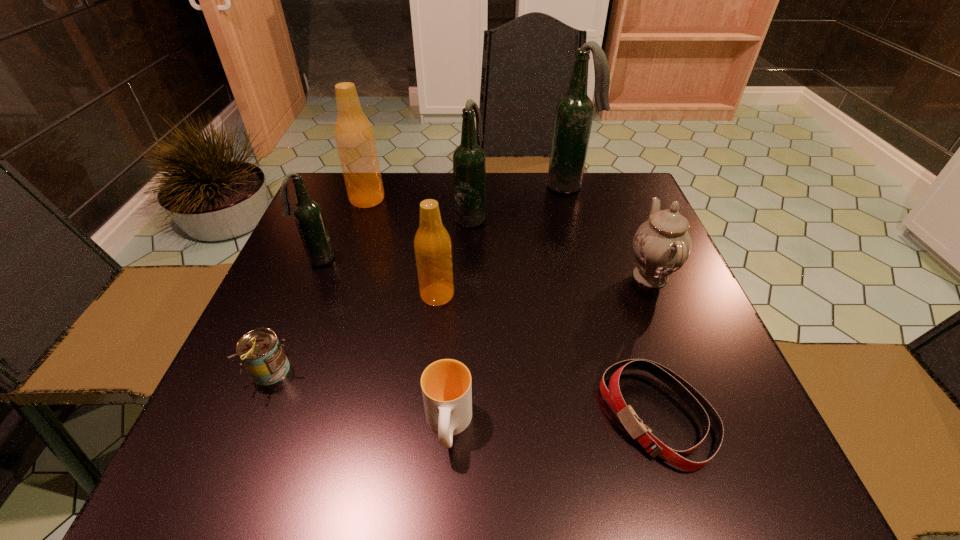
Locate an element on the screen. the farthest dark beer bottle is located at coordinates (574, 112).

You are a GUI agent. You are given a task and a screenshot of the screen. Output one action in this format:
    pyautogui.click(x=<x>, y=<y>)
    Task: Click on the biggest dark beer bottle
    
    Given the screenshot: What is the action you would take?
    pyautogui.click(x=574, y=112)

In order to click on the bigger tan beer bottle in this screenshot , I will do click(354, 136).

You are a GUI agent. You are given a task and a screenshot of the screen. Output one action in this format:
    pyautogui.click(x=<x>, y=<y>)
    Task: Click on the farther tan beer bottle
    
    Given the screenshot: What is the action you would take?
    pyautogui.click(x=354, y=136)

In order to click on the second farthest dark beer bottle in this screenshot , I will do `click(469, 161)`.

You are a GUI agent. You are given a task and a screenshot of the screen. Output one action in this format:
    pyautogui.click(x=<x>, y=<y>)
    Task: Click on the second dark beer bottle from right to left
    The image size is (960, 540).
    Given the screenshot: What is the action you would take?
    pyautogui.click(x=469, y=161)

You are a GUI agent. You are given a task and a screenshot of the screen. Output one action in this format:
    pyautogui.click(x=<x>, y=<y>)
    Task: Click on the leftmost dark beer bottle
    This screenshot has height=540, width=960.
    Given the screenshot: What is the action you would take?
    pyautogui.click(x=307, y=213)

At what (x,y) coordinates should I click in order to perform the action: click on the second nearest beer bottle. Please return your answer as a coordinate pair (x, y). Looking at the image, I should click on (307, 213).

Locate an element on the screen. the nearest beer bottle is located at coordinates (433, 250).

Identify the location of the smaller tan beer bottle. The height and width of the screenshot is (540, 960). (433, 250).